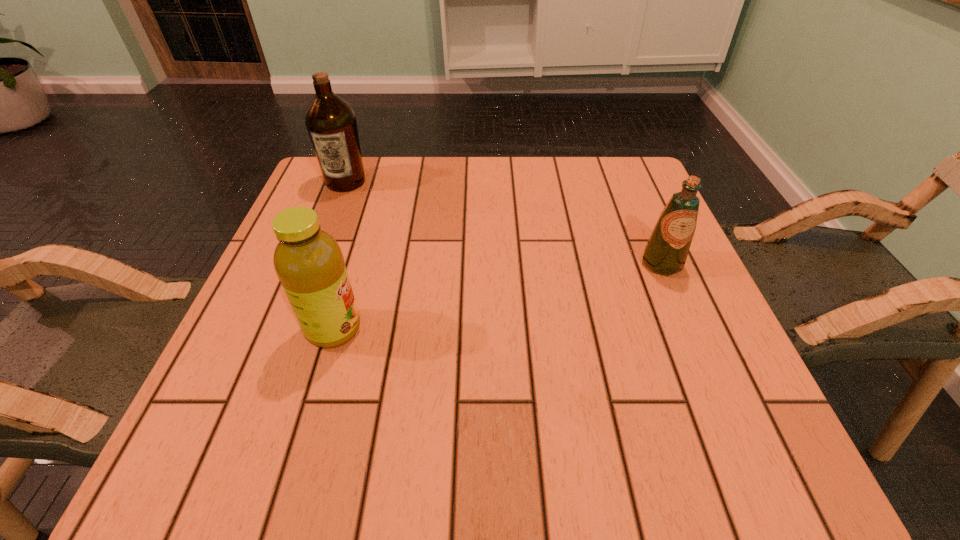
Locate an element on the screen. This screenshot has height=540, width=960. the farther olive oil is located at coordinates (331, 123).

Locate an element on the screen. the taller olive oil is located at coordinates (331, 123).

The height and width of the screenshot is (540, 960). Find the location of `fruit juice`. fruit juice is located at coordinates (309, 263).

You are a GUI agent. You are given a task and a screenshot of the screen. Output one action in this format:
    pyautogui.click(x=<x>, y=<y>)
    Task: Click on the nearer olive oil
    The image size is (960, 540).
    Given the screenshot: What is the action you would take?
    pyautogui.click(x=666, y=251)

Identify the location of the right olive oil. This screenshot has width=960, height=540. (666, 251).

Where is `vacant space located on the label of the farther olive oil`? Image resolution: width=960 pixels, height=540 pixels. vacant space located on the label of the farther olive oil is located at coordinates pyautogui.click(x=318, y=254).

Where is `free point located on the front label of the fruit juice`? free point located on the front label of the fruit juice is located at coordinates (567, 329).

This screenshot has height=540, width=960. I want to click on blank space located 0.360m on the front-facing side of the shortest object, so click(x=743, y=456).

Locate an element on the screen. object at the far edge is located at coordinates (331, 123).

The height and width of the screenshot is (540, 960). Find the location of `olive oil present at the left edge`. olive oil present at the left edge is located at coordinates (331, 123).